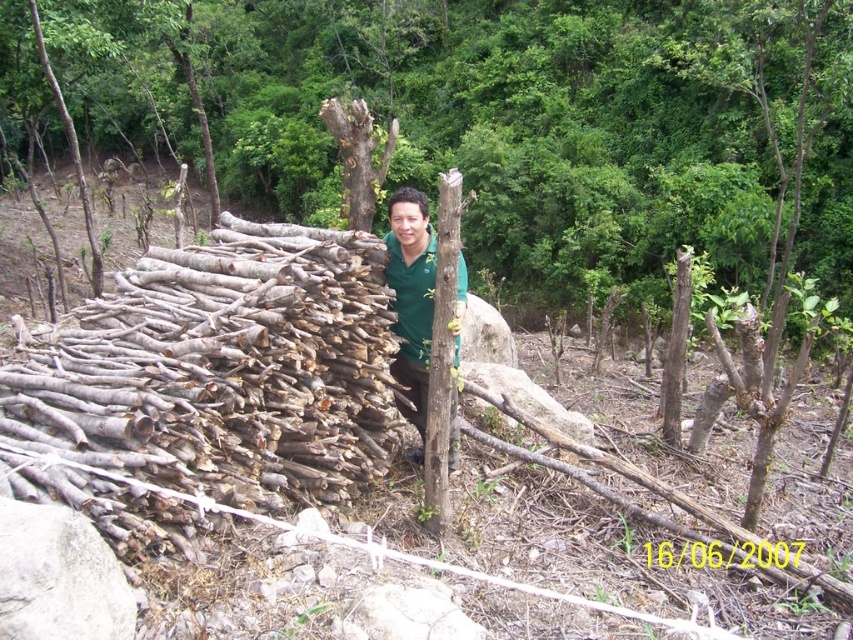
Question: Based on their relative distances, which object is nearer to the green matte shirt at center?

Choices:
 (A) brown rough wood at center
 (B) bark textured tree at center

Answer: (A)

Question: Can you confirm if brown rough wood at center is positioned below green matte shirt at center?

Choices:
 (A) no
 (B) yes

Answer: (A)

Question: Which object appears closest to the camera in this image?

Choices:
 (A) green matte shirt at center
 (B) brown rough wood at center

Answer: (B)

Question: Is brown rough wood at center smaller than green matte shirt at center?

Choices:
 (A) yes
 (B) no

Answer: (B)

Question: Observing the image, what is the correct spatial positioning of brown rough wood at center in reference to bark textured tree at center?

Choices:
 (A) above
 (B) below

Answer: (B)

Question: Which point is farther to the camera?

Choices:
 (A) (24, 378)
 (B) (781, 253)
 (C) (451, 460)

Answer: (B)